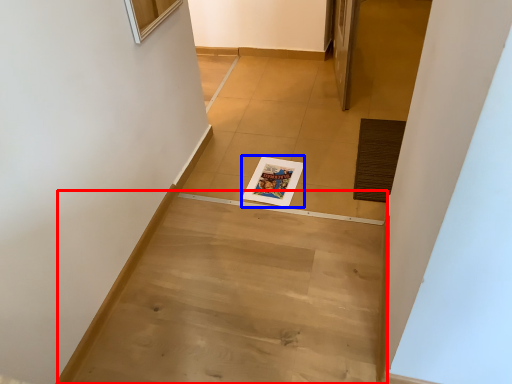
Question: Which of the following is the closest to the observer, stairwell (highlighted by a red box) or magazine (highlighted by a blue box)?

Choices:
 (A) stairwell
 (B) magazine

Answer: (A)